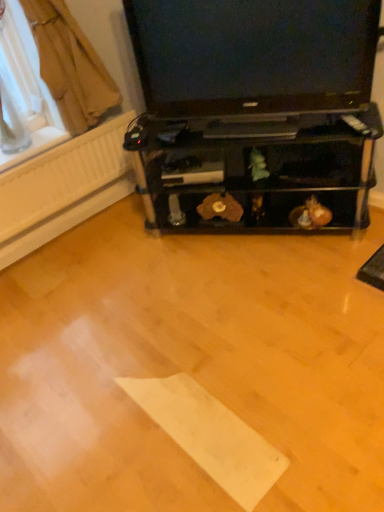
Question: Does black glossy television at upper center have a greater width compared to brown fabric curtain at upper left?

Choices:
 (A) yes
 (B) no

Answer: (B)

Question: From the image's perspective, does black glossy television at upper center appear lower than brown fabric curtain at upper left?

Choices:
 (A) yes
 (B) no

Answer: (A)

Question: Does black glossy television at upper center have a lesser width compared to brown fabric curtain at upper left?

Choices:
 (A) yes
 (B) no

Answer: (A)

Question: From the image's perspective, does black glossy television at upper center appear higher than brown fabric curtain at upper left?

Choices:
 (A) yes
 (B) no

Answer: (B)

Question: Can you confirm if black glossy television at upper center is smaller than brown fabric curtain at upper left?

Choices:
 (A) no
 (B) yes

Answer: (A)

Question: From a real-world perspective, is black glossy television at upper center physically above brown fabric curtain at upper left?

Choices:
 (A) no
 (B) yes

Answer: (A)

Question: Does black glossy television at upper center have a larger size compared to transparent plastic window screen at upper left?

Choices:
 (A) yes
 (B) no

Answer: (A)

Question: Is black glossy television at upper center positioned in front of transparent plastic window screen at upper left?

Choices:
 (A) no
 (B) yes

Answer: (B)

Question: From the image's perspective, is black glossy television at upper center beneath transparent plastic window screen at upper left?

Choices:
 (A) yes
 (B) no

Answer: (A)

Question: From a real-world perspective, is black glossy television at upper center located beneath transparent plastic window screen at upper left?

Choices:
 (A) no
 (B) yes

Answer: (B)

Question: From the image's perspective, is black glossy television at upper center over transparent plastic window screen at upper left?

Choices:
 (A) yes
 (B) no

Answer: (B)

Question: Can you confirm if black glossy television at upper center is shorter than transparent plastic window screen at upper left?

Choices:
 (A) no
 (B) yes

Answer: (B)

Question: Is transparent plastic window screen at upper left outside black glossy television at upper center?

Choices:
 (A) no
 (B) yes

Answer: (B)